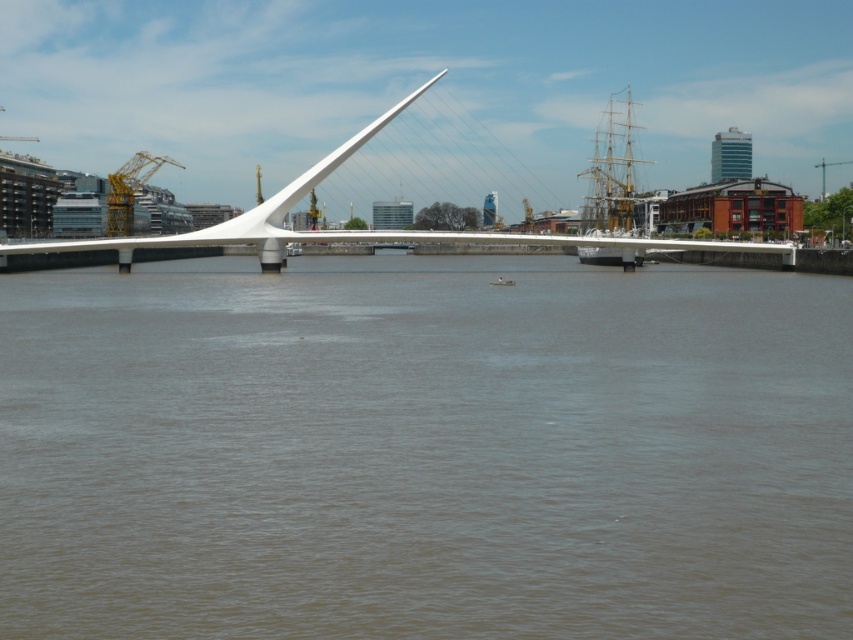
You are a city planner assessing the Puente de la Mujer bridge. You need to determine if a new 100 meter long pedestrian walkway can be placed between the brown matte water at center and the yellow metallic crane at upper left. Can it fit?

The distance between the brown matte water at center and the yellow metallic crane at upper left is 121.38 meters. Since the proposed 100 meter walkway is shorter than this distance, it can fit between them.

You are a photographer planning to capture a shot of the wooden ship at right and the yellow metallic crane at upper left. Based on their positions, which object would appear closer to the bottom of your photo?

The wooden ship at right is located below the yellow metallic crane at upper left, so in the photo, the wooden ship at right would appear closer to the bottom of the frame.

You are a tourist standing on the Puente de la Mujer bridge and looking at the brown matte water at center and the wooden ship at right. Which object is located lower in the scene?

The brown matte water at center is located lower than the wooden ship at right because it is positioned below it.